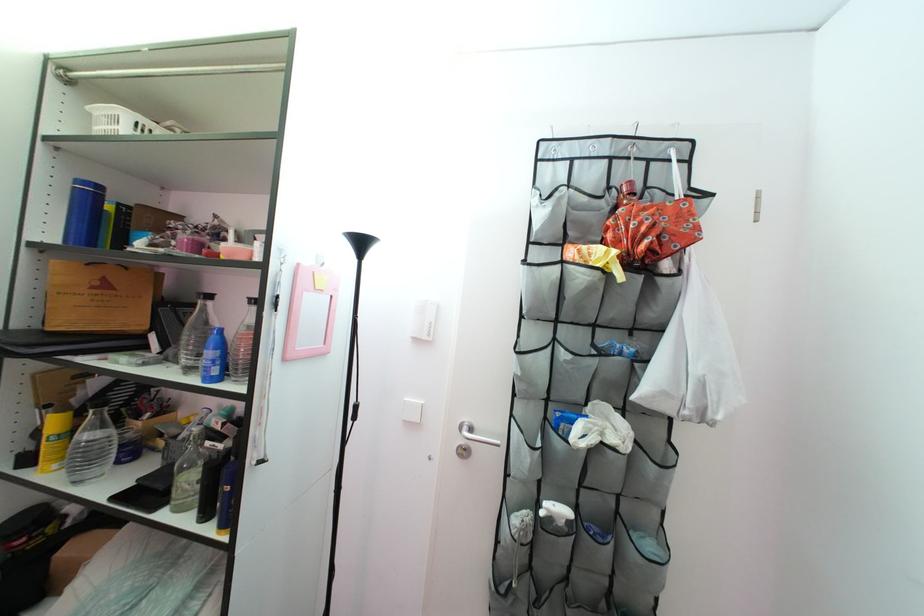
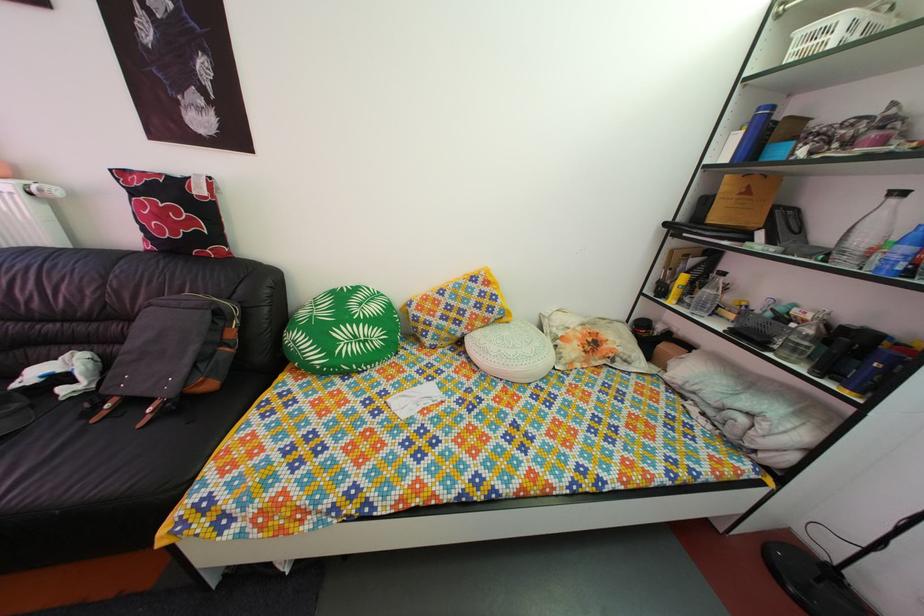
The first image is from the beginning of the video and the second image is from the end. How did the camera likely rotate when shooting the video?

The rotation direction of the camera is left-down.